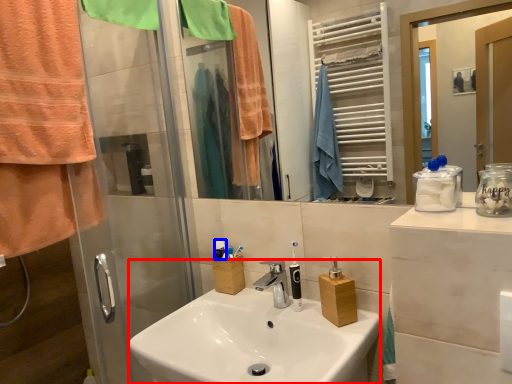
Question: Which of the following is the closest to the observer, sink (highlighted by a red box) or toiletries (highlighted by a blue box)?

Choices:
 (A) sink
 (B) toiletries

Answer: (A)